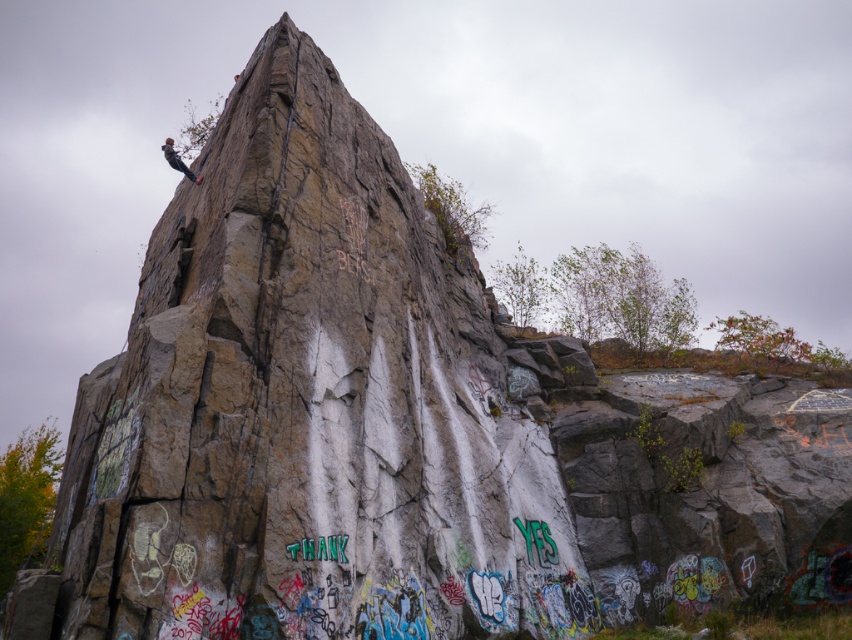
Is rough stone rock at center to the right of matte black rock climber at upper left from the viewer's perspective?

Yes, rough stone rock at center is to the right of matte black rock climber at upper left.

Describe the element at coordinates (312, 406) in the screenshot. The width and height of the screenshot is (852, 640). I see `rough stone rock at center` at that location.

Consider the image. Who is more distant from viewer, (288, 573) or (165, 140)?

The point (165, 140) is behind.

The image size is (852, 640). I want to click on rough stone rock at center, so click(x=312, y=406).